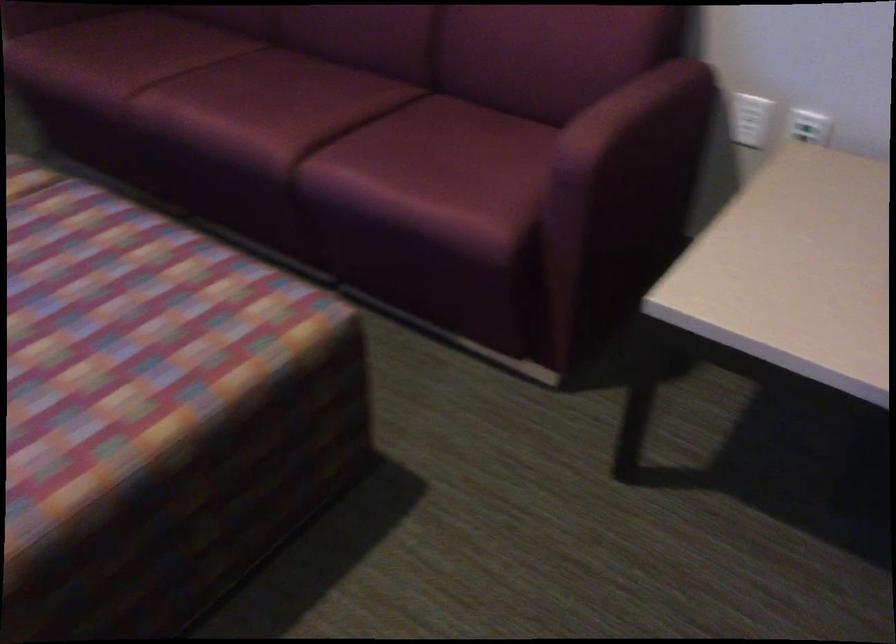
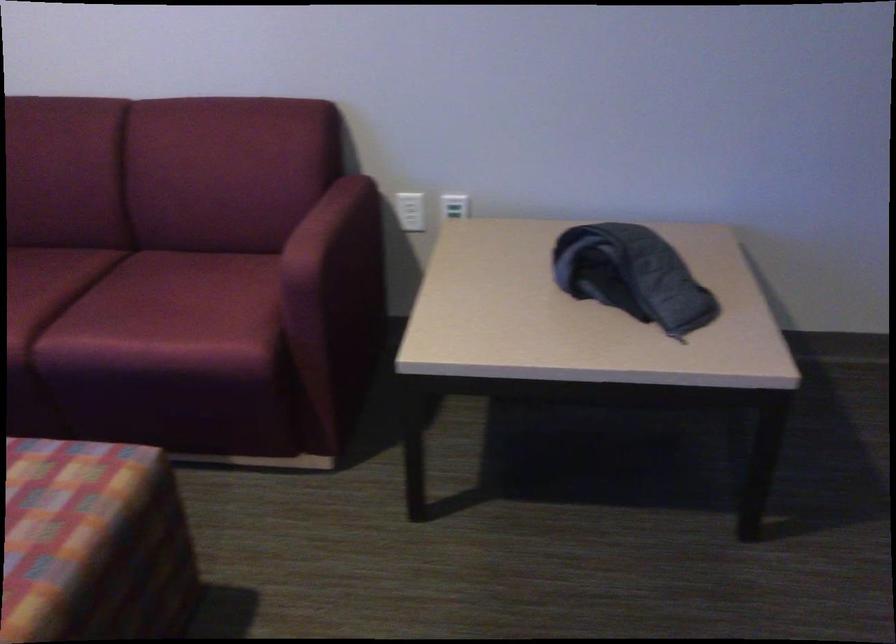
Where in the second image is the point corresponding to (251,386) from the first image?

(93, 544)